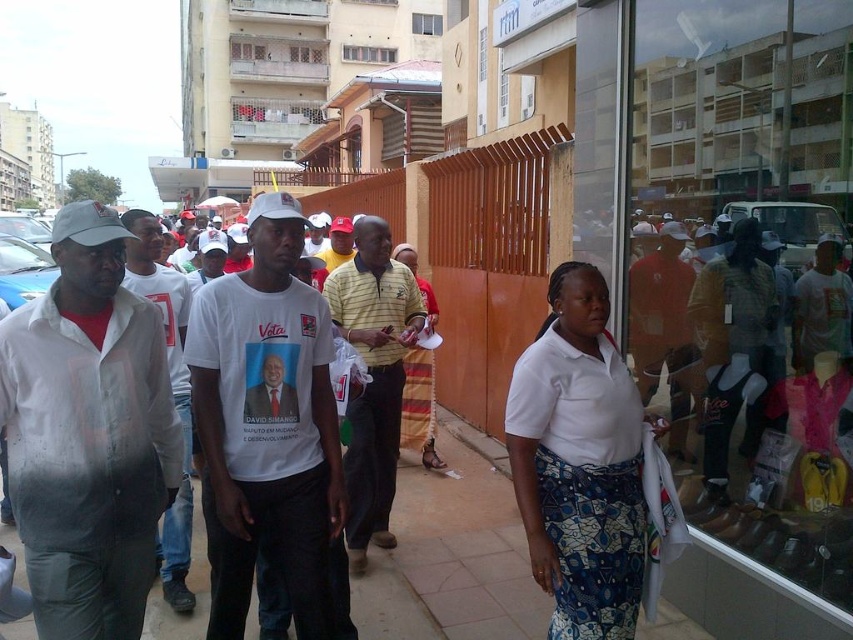
Question: Which point is closer to the camera taking this photo?

Choices:
 (A) (403, 529)
 (B) (172, 458)
 (C) (167, 528)
 (D) (396, 288)

Answer: (B)

Question: Among these points, which one is nearest to the camera?

Choices:
 (A) (114, 342)
 (B) (183, 451)

Answer: (A)

Question: Among these objects, which one is nearest to the camera?

Choices:
 (A) white matte t-shirt at center
 (B) white matte shirt at left
 (C) white matte shirt at center

Answer: (B)

Question: Can you confirm if white matte shirt at left is positioned below brown concrete pavement at center?

Choices:
 (A) yes
 (B) no

Answer: (B)

Question: Considering the relative positions of white matte shirt at left and white matte t-shirt at center in the image provided, where is white matte shirt at left located with respect to white matte t-shirt at center?

Choices:
 (A) above
 (B) below

Answer: (A)

Question: Does white matte t-shirt at center appear over white matte shirt at center?

Choices:
 (A) yes
 (B) no

Answer: (B)